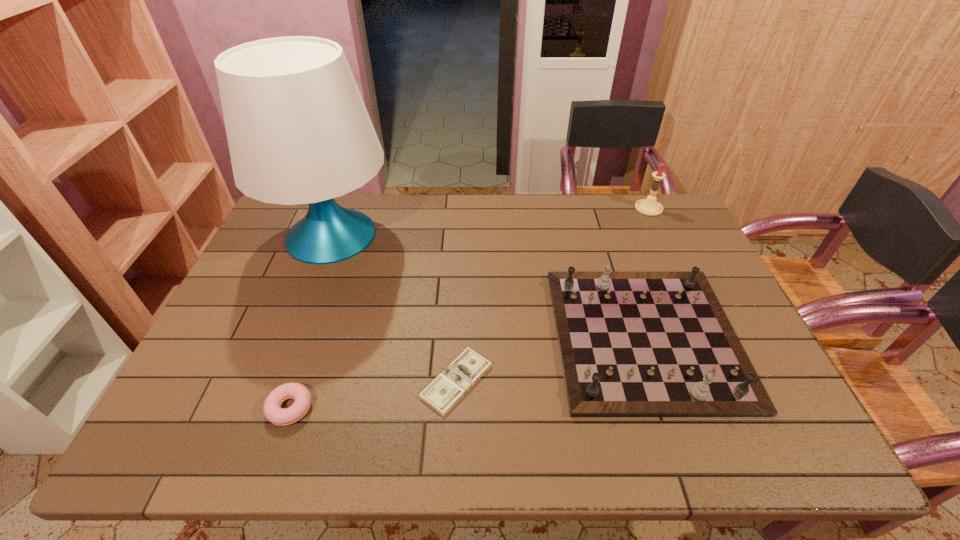
In order to click on blank space at the left edge of the desktop in this screenshot , I will do `click(244, 341)`.

Locate an element on the screen. The width and height of the screenshot is (960, 540). free space at the right edge of the desktop is located at coordinates (671, 237).

In the image, there is a desktop. Identify the location of vacant space at the near right corner. (807, 448).

Find the location of a particular element. The width and height of the screenshot is (960, 540). empty space that is in between the dollar and the second shortest object is located at coordinates (373, 394).

This screenshot has width=960, height=540. I want to click on free space that is in between the table lamp and the third shortest object, so click(x=489, y=286).

Where is `vacant space that is in between the candle and the doughnut`? The image size is (960, 540). vacant space that is in between the candle and the doughnut is located at coordinates (469, 308).

Identify the location of vacant area that lies between the chessboard and the dollar. This screenshot has height=540, width=960. (551, 359).

Locate an element on the screen. The height and width of the screenshot is (540, 960). empty space that is in between the tallest object and the candle is located at coordinates 491,221.

The image size is (960, 540). Identify the location of object that is the second closest to the table lamp. (273, 412).

Identify which object is the fourth closest to the tallest object. Please provide its 2D coordinates. Your answer should be formatted as a tuple, i.e. [(x, y)], where the tuple contains the x and y coordinates of a point satisfying the conditions above.

[(650, 207)]